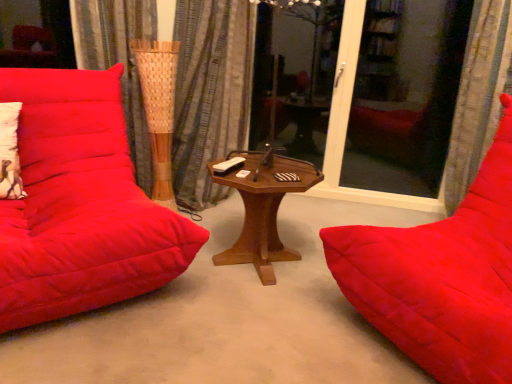
Where is `vacant area that lies in front of wooden hexagonal table at center`? vacant area that lies in front of wooden hexagonal table at center is located at coordinates (256, 320).